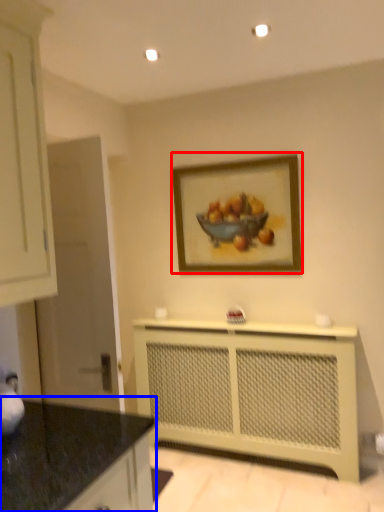
Question: Which object is further to the camera taking this photo, picture frame (highlighted by a red box) or countertop (highlighted by a blue box)?

Choices:
 (A) picture frame
 (B) countertop

Answer: (A)